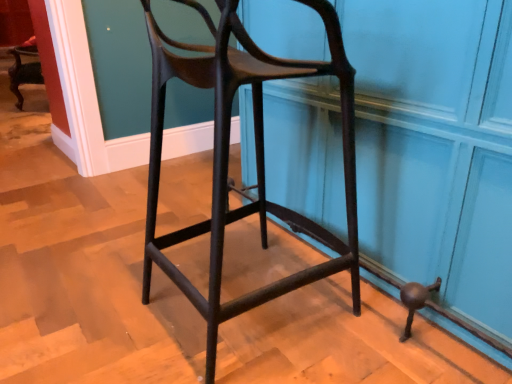
Question: From their relative heights in the image, would you say matte black stool at center is taller or shorter than matte black stool at center?

Choices:
 (A) short
 (B) tall

Answer: (B)

Question: Considering the positions of matte black stool at center and matte black stool at center in the image, is matte black stool at center wider or thinner than matte black stool at center?

Choices:
 (A) thin
 (B) wide

Answer: (A)

Question: Is matte black stool at center bigger or smaller than matte black stool at center?

Choices:
 (A) big
 (B) small

Answer: (B)

Question: Is point (508, 192) positioned closer to the camera than point (223, 241)?

Choices:
 (A) closer
 (B) farther

Answer: (A)

Question: From their relative heights in the image, would you say matte black stool at center is taller or shorter than matte black stool at center?

Choices:
 (A) short
 (B) tall

Answer: (A)

Question: From the image's perspective, relative to matte black stool at center, is matte black stool at center above or below?

Choices:
 (A) above
 (B) below

Answer: (A)

Question: Is matte black stool at center in front of or behind matte black stool at center in the image?

Choices:
 (A) front
 (B) behind

Answer: (B)